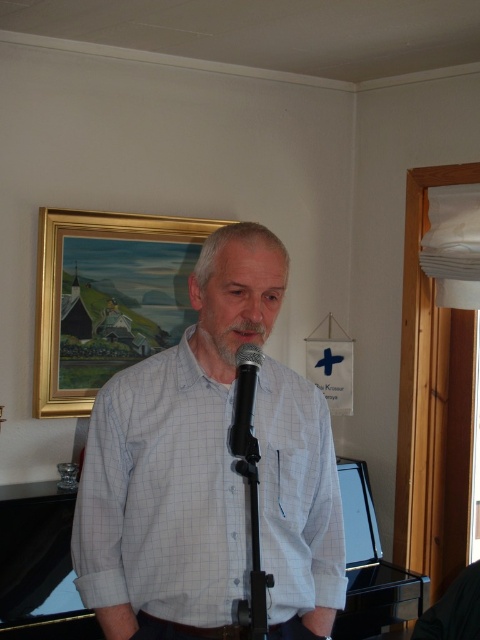
Between white checkered shirt at center and black metallic microphone at center, which one is positioned lower?

white checkered shirt at center

Can you confirm if white checkered shirt at center is taller than black metallic microphone at center?

Yes, white checkered shirt at center is taller than black metallic microphone at center.

Between point (320, 412) and point (257, 360), which one is positioned behind?

The point (320, 412) is more distant.

Find the location of a particular element. white checkered shirt at center is located at coordinates (177, 458).

How much distance is there between white checkered shirt at center and gold-framed painting at upper center?

A distance of 1.42 meters exists between white checkered shirt at center and gold-framed painting at upper center.

Is white checkered shirt at center taller than gold-framed painting at upper center?

Yes.

This screenshot has height=640, width=480. Find the location of `white checkered shirt at center`. white checkered shirt at center is located at coordinates (177, 458).

You are a GUI agent. You are given a task and a screenshot of the screen. Output one action in this format:
    pyautogui.click(x=<x>, y=<y>)
    Task: Click on the white checkered shirt at center
    The height and width of the screenshot is (640, 480).
    Given the screenshot: What is the action you would take?
    pyautogui.click(x=177, y=458)

Does gold-framed painting at upper center lie in front of black metallic microphone at center?

No, gold-framed painting at upper center is behind black metallic microphone at center.

Is gold-framed painting at upper center to the right of black metallic microphone at center from the viewer's perspective?

In fact, gold-framed painting at upper center is to the left of black metallic microphone at center.

Identify the location of gold-framed painting at upper center. Image resolution: width=480 pixels, height=640 pixels. 107,298.